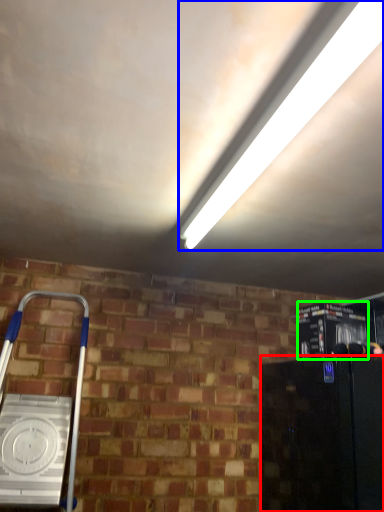
Question: Which object is the farthest from appliance (highlighted by a red box)? Choose among these: light (highlighted by a blue box) or appliance (highlighted by a green box).

Choices:
 (A) light
 (B) appliance

Answer: (A)